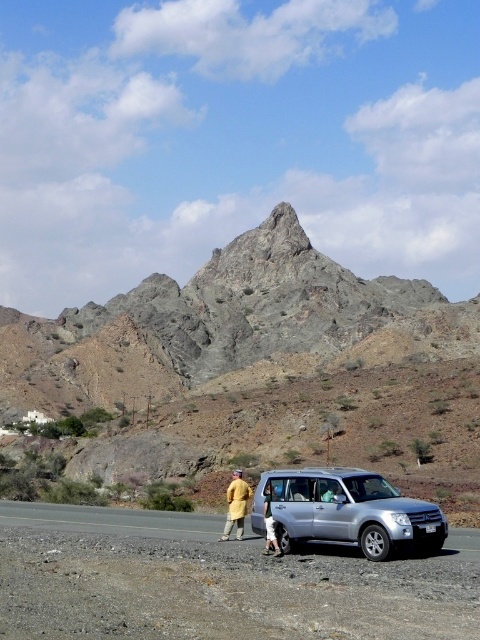
Can you confirm if gray rocky mountain at upper center is smaller than yellow fabric coat at center?

Actually, gray rocky mountain at upper center might be larger than yellow fabric coat at center.

Between gray rocky mountain at upper center and yellow fabric coat at center, which one has less height?

yellow fabric coat at center is shorter.

Which is in front, point (251, 358) or point (242, 512)?

Point (242, 512) is more forward.

Find the location of a particular element. The image size is (480, 640). gray rocky mountain at upper center is located at coordinates (213, 323).

Describe the element at coordinates (347, 512) in the screenshot. This screenshot has height=640, width=480. I see `silver metallic suv at center` at that location.

Does silver metallic suv at center have a smaller size compared to light brown leather jacket at lower center?

Incorrect, silver metallic suv at center is not smaller in size than light brown leather jacket at lower center.

Is point (273, 492) positioned in front of point (275, 536)?

No, (273, 492) is further to viewer.

Identify the location of silver metallic suv at center. The height and width of the screenshot is (640, 480). (347, 512).

Is silver metallic suv at center smaller than yellow fabric coat at center?

Indeed, silver metallic suv at center has a smaller size compared to yellow fabric coat at center.

Can you confirm if silver metallic suv at center is thinner than yellow fabric coat at center?

In fact, silver metallic suv at center might be wider than yellow fabric coat at center.

Does point (352, 506) come closer to viewer compared to point (236, 490)?

Yes, point (352, 506) is in front of point (236, 490).

I want to click on silver metallic suv at center, so click(x=347, y=512).